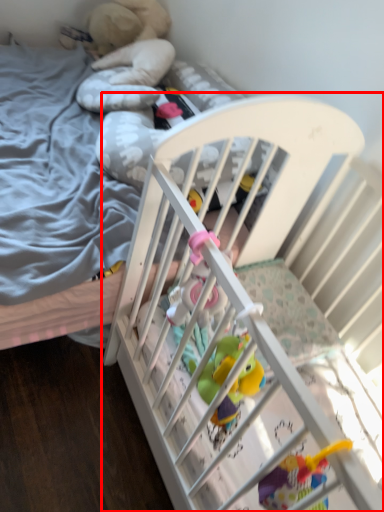
Question: From the image, what is the correct spatial relationship of infant bed (annotated by the red box) in relation to toy?

Choices:
 (A) right
 (B) left

Answer: (B)